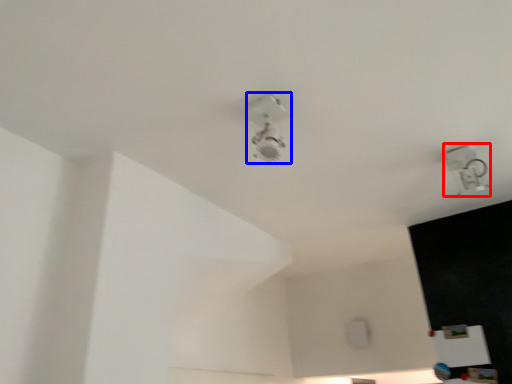
Question: Which object is closer to the camera taking this photo, lamp (highlighted by a red box) or lamp (highlighted by a blue box)?

Choices:
 (A) lamp
 (B) lamp

Answer: (B)